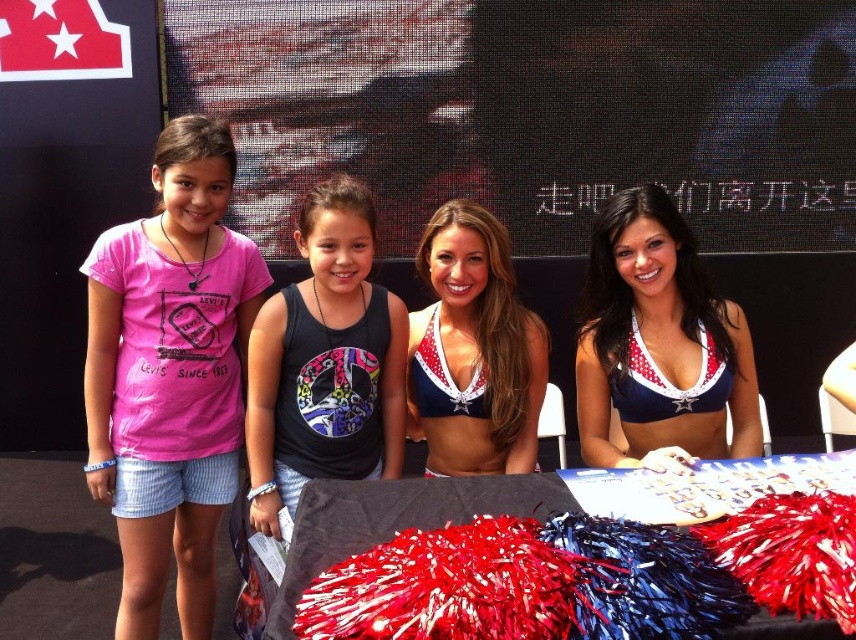
Question: Estimate the real-world distances between objects in this image. Which object is closer to the black matte tank top at center?

Choices:
 (A) pink cotton t-shirt at left
 (B) red and white bikini top at center
 (C) matte blue bikini top at center

Answer: (C)

Question: Which point is closer to the camera taking this photo?

Choices:
 (A) (357, 256)
 (B) (714, 310)

Answer: (A)

Question: Which point is closer to the camera?

Choices:
 (A) black matte tank top at center
 (B) pink cotton t-shirt at left
 (C) matte blue bikini top at center

Answer: (A)

Question: Is red and white bikini top at center wider than black matte tank top at center?

Choices:
 (A) no
 (B) yes

Answer: (B)

Question: Can you confirm if pink cotton t-shirt at left is thinner than red fabric pom-poms at center?

Choices:
 (A) no
 (B) yes

Answer: (B)

Question: From the image, what is the correct spatial relationship of pink cotton t-shirt at left in relation to red and white bikini top at center?

Choices:
 (A) below
 (B) above

Answer: (A)